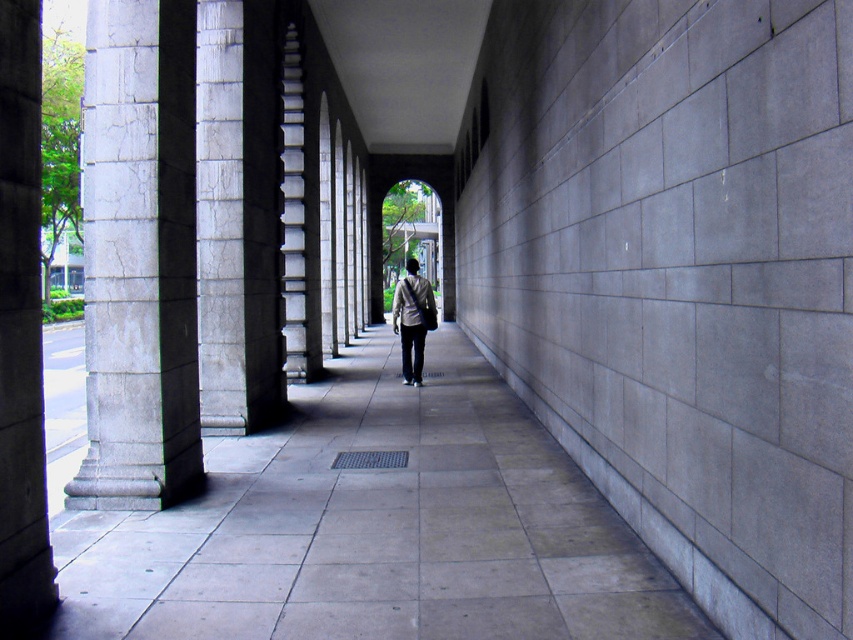
You are standing at the entrance of the walkway and notice a gray concrete pavement at center and a light gray fabric jacket at center. Which object is taller from your perspective?

The light gray fabric jacket at center is taller than the gray concrete pavement at center.

Looking at this image, you are standing at the entrance of the walkway and see the gray concrete pavement at center and the light gray fabric jacket at center. Which object takes up more visual space in the scene?

The gray concrete pavement at center takes up more visual space in the scene as it is bigger than the light gray fabric jacket at center.